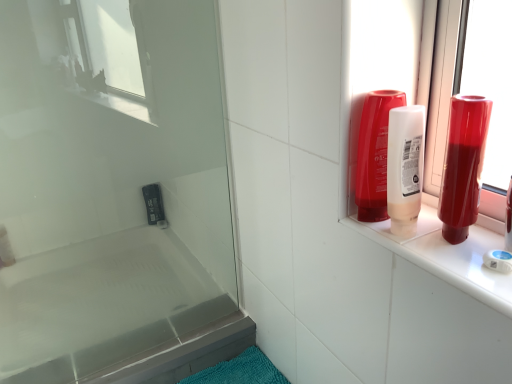
At what (x,y) coordinates should I click in order to perform the action: click on vacant space in transparent glass screen door at upper left (from a real-world perspective). Please return your answer as a coordinate pair (x, y). This screenshot has width=512, height=384. Looking at the image, I should click on (156, 347).